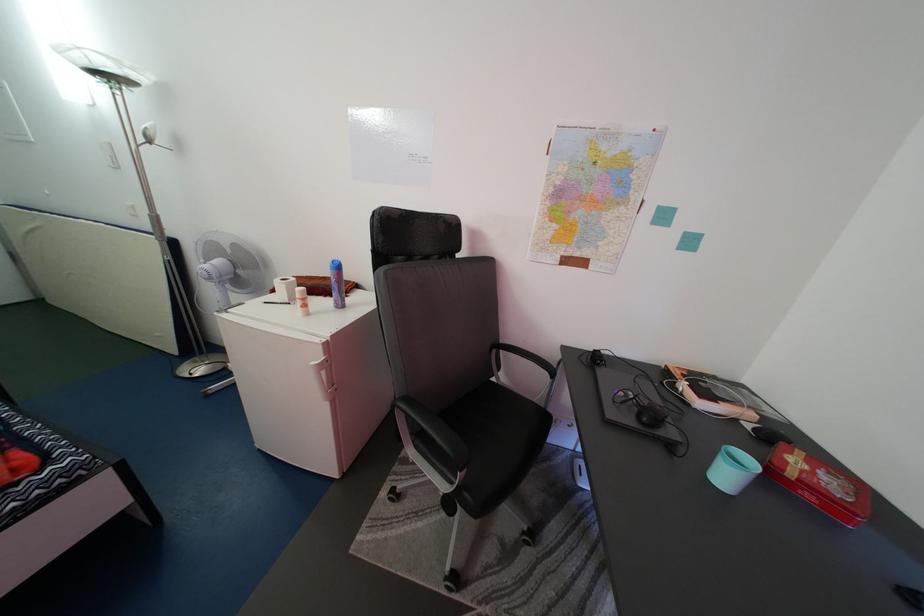
Locate an element on the screen. light blue cup is located at coordinates (733, 469).